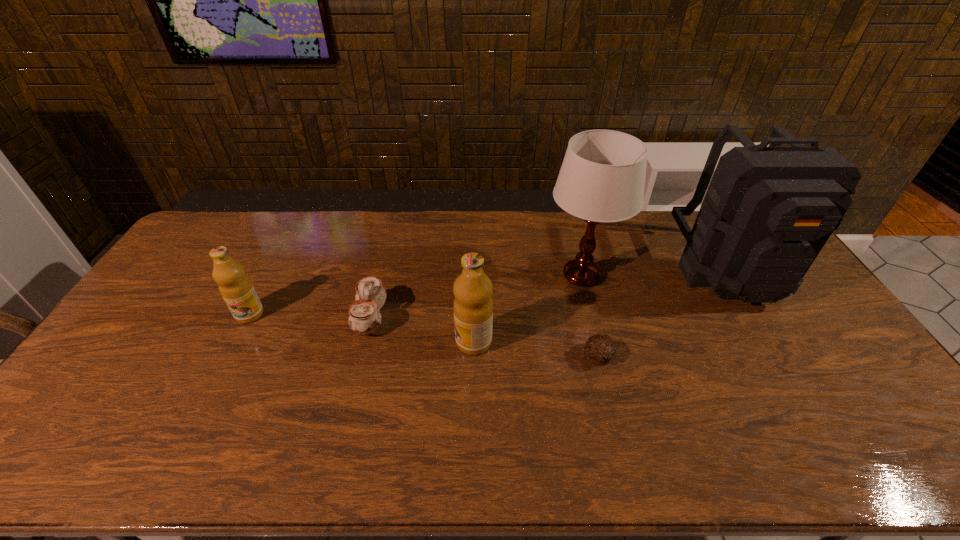
Please show where to add a olive oil on the right while keeping spacing even. Please provide its 2D coordinates. Your answer should be formatted as a tuple, i.e. [(x, y)], where the tuple contains the x and y coordinates of a point satisfying the conditions above.

[(727, 373)]